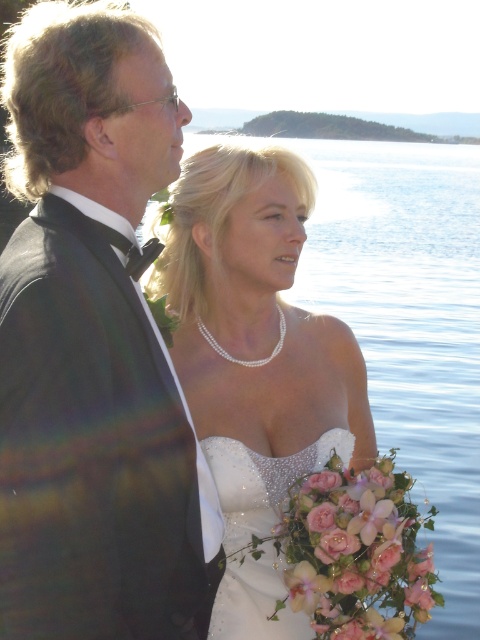
Is pearl necklace at center bigger than sparkly white dress at center?

Correct, pearl necklace at center is larger in size than sparkly white dress at center.

Consider the image. Does pearl necklace at center lie in front of sparkly white dress at center?

No, it is behind sparkly white dress at center.

Identify the location of pearl necklace at center. (255, 358).

Does shiny black tuxedo at left have a greater width compared to sparkly white dress at center?

Yes, shiny black tuxedo at left is wider than sparkly white dress at center.

Consider the image. Is shiny black tuxedo at left closer to camera compared to sparkly white dress at center?

That is True.

You are a GUI agent. You are given a task and a screenshot of the screen. Output one action in this format:
    pyautogui.click(x=<x>, y=<y>)
    Task: Click on the shiny black tuxedo at left
    The height and width of the screenshot is (640, 480).
    Given the screenshot: What is the action you would take?
    pyautogui.click(x=94, y=346)

Does shiny black tuxedo at left have a larger size compared to pearl necklace at center?

Yes, shiny black tuxedo at left is bigger than pearl necklace at center.

Can you confirm if shiny black tuxedo at left is positioned above pearl necklace at center?

Yes.

Image resolution: width=480 pixels, height=640 pixels. Describe the element at coordinates (94, 346) in the screenshot. I see `shiny black tuxedo at left` at that location.

This screenshot has height=640, width=480. What are the coordinates of `shiny black tuxedo at left` in the screenshot? It's located at (94, 346).